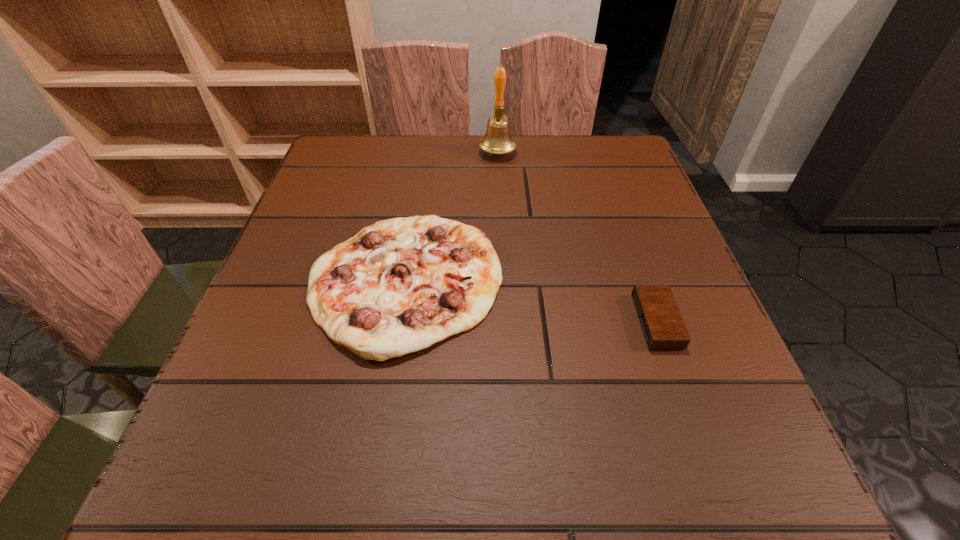
This screenshot has height=540, width=960. I want to click on the tallest object, so click(x=497, y=140).

Find the location of a particular element. The width and height of the screenshot is (960, 540). the farthest object is located at coordinates (497, 140).

Image resolution: width=960 pixels, height=540 pixels. What are the coordinates of `pizza` in the screenshot? It's located at (398, 286).

At what (x,y) coordinates should I click in order to perform the action: click on the shortest object. Please return your answer as a coordinate pair (x, y). This screenshot has height=540, width=960. Looking at the image, I should click on (663, 327).

Locate an element on the screen. alarm clock is located at coordinates (663, 327).

This screenshot has height=540, width=960. I want to click on vacant space located 0.050m on the left of the tallest object, so click(459, 153).

Image resolution: width=960 pixels, height=540 pixels. I want to click on vacant region located 0.070m on the front of the second tallest object, so click(x=385, y=408).

The height and width of the screenshot is (540, 960). In order to click on vacant space located on the front face of the rightmost object in this screenshot , I will do `click(538, 321)`.

Where is `vacant region located on the front face of the rightmost object`? vacant region located on the front face of the rightmost object is located at coordinates (538, 321).

Locate an element on the screen. vacant region located on the front face of the rightmost object is located at coordinates (437, 321).